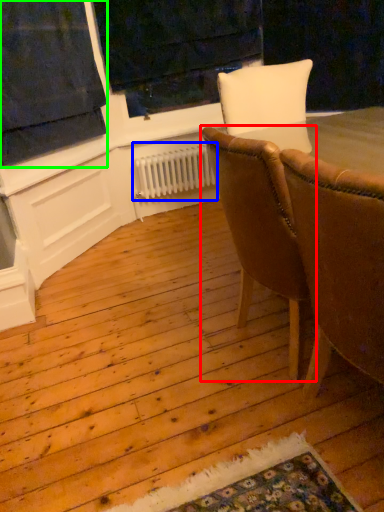
Question: Which is farther away from chair (highlighted by a red box)? radiator (highlighted by a blue box) or curtain (highlighted by a green box)?

Choices:
 (A) radiator
 (B) curtain

Answer: (A)